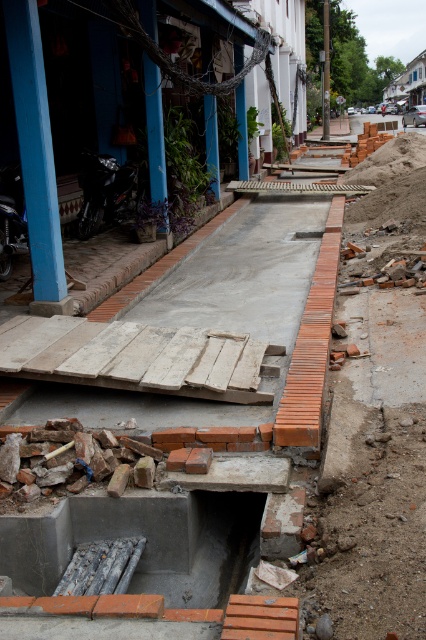
Question: Can you confirm if blue painted wood at left is positioned to the right of blue painted wood at upper left?

Choices:
 (A) no
 (B) yes

Answer: (A)

Question: Can you confirm if blue painted wood at upper left is smaller than brushed metal pole at center?

Choices:
 (A) yes
 (B) no

Answer: (A)

Question: Estimate the real-world distances between objects in this image. Which object is closer to the blue painted wood at upper left?

Choices:
 (A) blue painted wood at left
 (B) brushed metal pole at center

Answer: (A)

Question: Which point is closer to the camera?

Choices:
 (A) brushed metal pole at center
 (B) blue painted wood at left
 (C) blue painted wood at upper left

Answer: (B)

Question: Which object is farther from the camera taking this photo?

Choices:
 (A) blue painted wood at left
 (B) blue painted wood at upper left

Answer: (B)

Question: Is blue painted wood at left smaller than brushed metal pole at center?

Choices:
 (A) yes
 (B) no

Answer: (A)